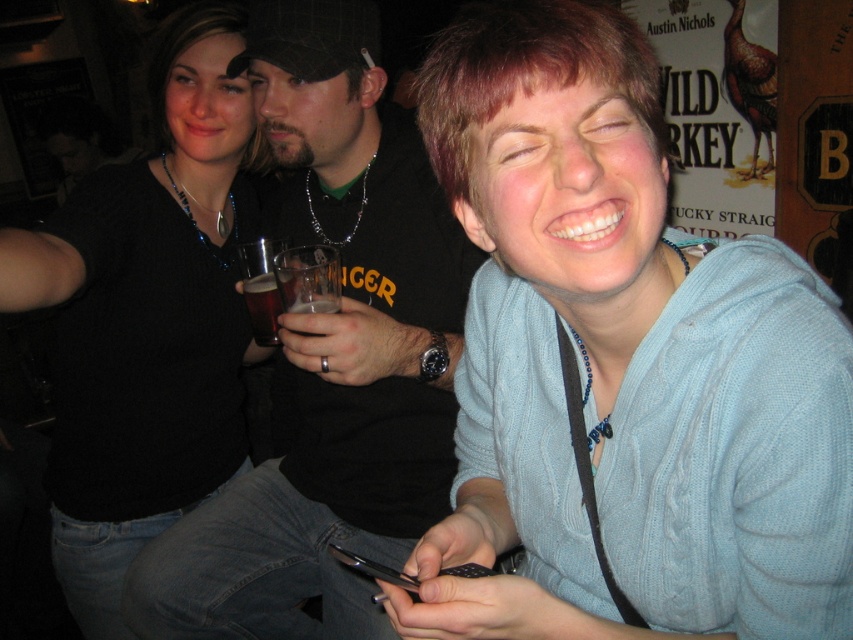
Question: Which object is the farthest from the black matte sweater at upper left?

Choices:
 (A) brown translucent glass at center
 (B) cable-knit sweater at center
 (C) black shirt at center

Answer: (B)

Question: Is cable-knit sweater at center above black shirt at center?

Choices:
 (A) yes
 (B) no

Answer: (B)

Question: From the image, what is the correct spatial relationship of black shirt at center in relation to brown translucent glass at center?

Choices:
 (A) right
 (B) left

Answer: (A)

Question: Estimate the real-world distances between objects in this image. Which object is farther from the black shirt at center?

Choices:
 (A) black matte sweater at upper left
 (B) brown translucent glass at center

Answer: (B)

Question: Estimate the real-world distances between objects in this image. Which object is closer to the black matte sweater at upper left?

Choices:
 (A) cable-knit sweater at center
 (B) brown translucent glass at center
 (C) black shirt at center

Answer: (C)

Question: Does cable-knit sweater at center have a lesser width compared to brown translucent glass at center?

Choices:
 (A) yes
 (B) no

Answer: (B)